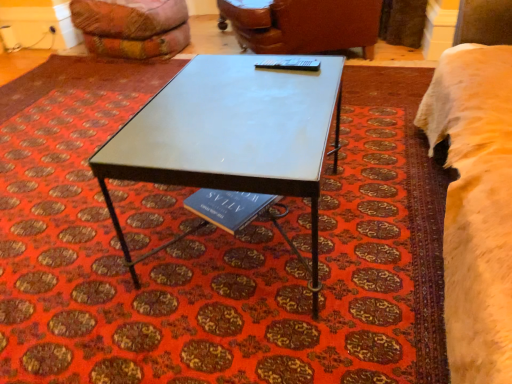
Question: From a real-world perspective, is velvet orange bean bag at upper left located beneath fuzzy cream bed at right?

Choices:
 (A) yes
 (B) no

Answer: (A)

Question: Considering the relative sizes of velvet orange bean bag at upper left and fuzzy cream bed at right in the image provided, is velvet orange bean bag at upper left thinner than fuzzy cream bed at right?

Choices:
 (A) no
 (B) yes

Answer: (A)

Question: Is velvet orange bean bag at upper left in front of fuzzy cream bed at right?

Choices:
 (A) no
 (B) yes

Answer: (A)

Question: Would you say fuzzy cream bed at right is part of velvet orange bean bag at upper left's contents?

Choices:
 (A) no
 (B) yes

Answer: (A)

Question: Does velvet orange bean bag at upper left have a lesser height compared to fuzzy cream bed at right?

Choices:
 (A) yes
 (B) no

Answer: (A)

Question: Is velvet orange bean bag at upper left positioned far away from fuzzy cream bed at right?

Choices:
 (A) yes
 (B) no

Answer: (A)

Question: From the image's perspective, is metallic blue table tennis table at center over metallic gray table at center?

Choices:
 (A) no
 (B) yes

Answer: (B)

Question: Does metallic blue table tennis table at center have a lesser width compared to metallic gray table at center?

Choices:
 (A) yes
 (B) no

Answer: (A)

Question: Considering the relative positions of metallic blue table tennis table at center and metallic gray table at center in the image provided, is metallic blue table tennis table at center to the left of metallic gray table at center from the viewer's perspective?

Choices:
 (A) yes
 (B) no

Answer: (B)

Question: Is metallic blue table tennis table at center shorter than metallic gray table at center?

Choices:
 (A) yes
 (B) no

Answer: (A)

Question: Is metallic gray table at center completely or partially inside metallic blue table tennis table at center?

Choices:
 (A) no
 (B) yes

Answer: (A)

Question: Considering the relative positions of metallic blue table tennis table at center and metallic gray table at center in the image provided, is metallic blue table tennis table at center in front of metallic gray table at center?

Choices:
 (A) no
 (B) yes

Answer: (A)

Question: Would you consider fuzzy cream bed at right to be distant from velvet orange bean bag at upper left?

Choices:
 (A) no
 (B) yes

Answer: (B)